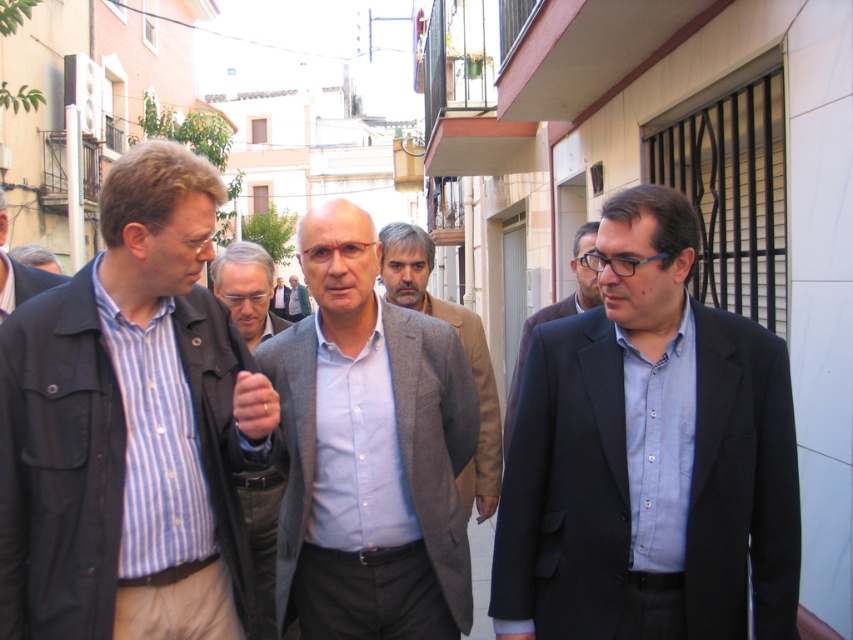
Question: Among these objects, which one is farthest from the camera?

Choices:
 (A) light gray wool coat at center
 (B) blue striped shirt at center

Answer: (A)

Question: Which object is the farthest from the blue striped shirt at center?

Choices:
 (A) light blue fabric jacket at center
 (B) dark blue suit at center
 (C) light blue shirt at center
 (D) dark gray suit at center

Answer: (C)

Question: Does light gray wool coat at center have a larger size compared to light brown leather jacket at center?

Choices:
 (A) no
 (B) yes

Answer: (A)

Question: Which point is closer to the camera?

Choices:
 (A) (390, 256)
 (B) (352, 291)
 (C) (305, 316)

Answer: (B)

Question: Is light blue fabric jacket at center above light brown leather jacket at center?

Choices:
 (A) yes
 (B) no

Answer: (B)

Question: Can you confirm if dark gray suit at center is thinner than light blue shirt at center?

Choices:
 (A) no
 (B) yes

Answer: (B)